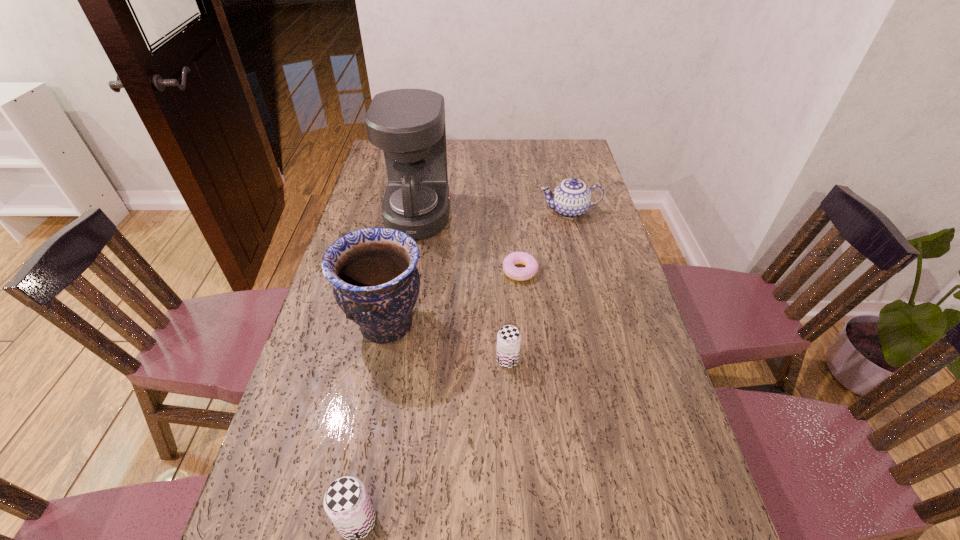
Locate an element on the screen. free space at the near left corner of the desktop is located at coordinates (269, 503).

Locate an element on the screen. vacant area that lies between the chinaware and the coffee maker is located at coordinates (493, 213).

Locate an element on the screen. Image resolution: width=960 pixels, height=540 pixels. empty space between the shortest object and the tallest object is located at coordinates (469, 243).

Locate an element on the screen. This screenshot has height=540, width=960. free space between the chinaware and the second tallest object is located at coordinates (478, 268).

Identify the location of unoccupied position between the second tallest object and the doughnut. (453, 299).

The image size is (960, 540). I want to click on vacant space that's between the pottery and the shorter beer can, so click(446, 343).

Where is `object that stands as the fourth closest to the chinaware`? The image size is (960, 540). object that stands as the fourth closest to the chinaware is located at coordinates (508, 338).

Select which object appears as the closest to the left beer can. Please provide its 2D coordinates. Your answer should be formatted as a tuple, i.e. [(x, y)], where the tuple contains the x and y coordinates of a point satisfying the conditions above.

[(376, 283)]

Locate an element on the screen. The width and height of the screenshot is (960, 540). free space that satisfies the following two spatial constraints: 1. on the back side of the shortest object; 2. on the left side of the second shortest object is located at coordinates (503, 271).

The height and width of the screenshot is (540, 960). Identify the location of vacant space that satisfies the following two spatial constraints: 1. on the button side of the coffee maker; 2. on the back side of the shortest object. (409, 271).